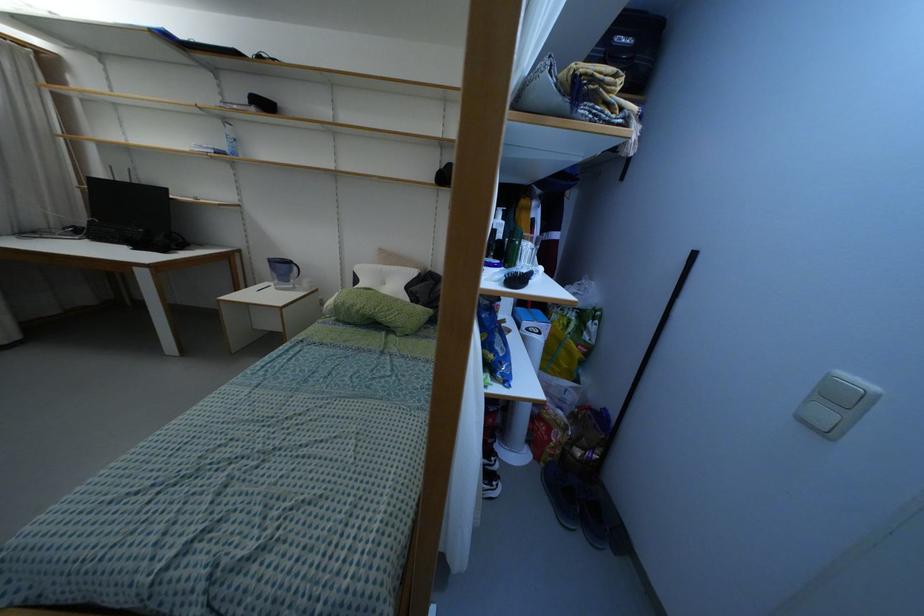
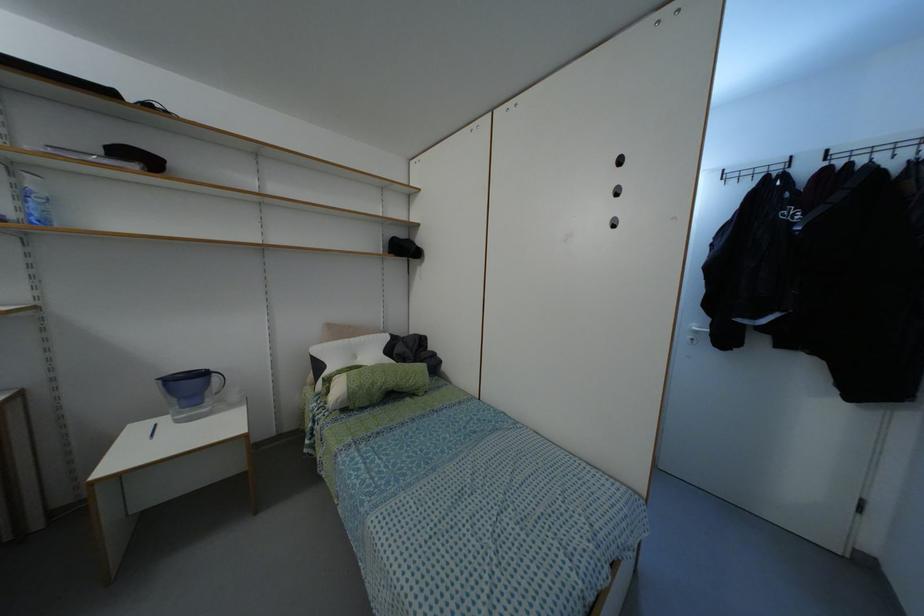
Find the pixel in the second image that matches pixel 379 265 in the first image.

(345, 339)